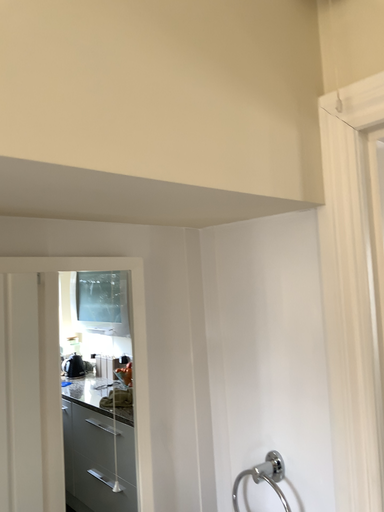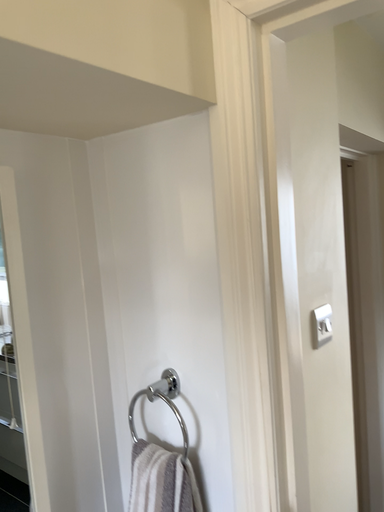
Question: How did the camera likely rotate when shooting the video?

Choices:
 (A) rotated left
 (B) rotated right

Answer: (B)